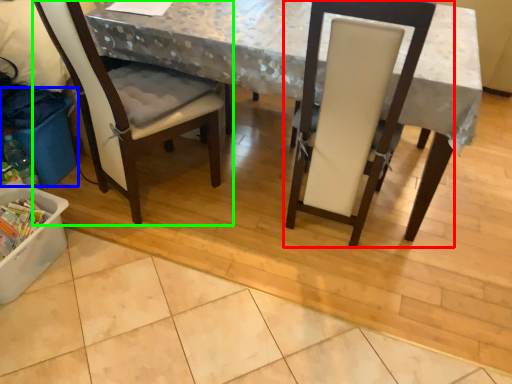
Question: Considering the real-world distances, which object is farthest from chair (highlighted by a red box)? recycling bin (highlighted by a blue box) or chair (highlighted by a green box)?

Choices:
 (A) recycling bin
 (B) chair

Answer: (A)